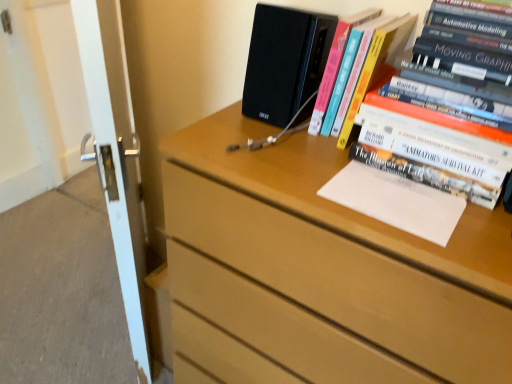
Where is `free space to the left of white glossy screen door at left`? The width and height of the screenshot is (512, 384). free space to the left of white glossy screen door at left is located at coordinates (64, 288).